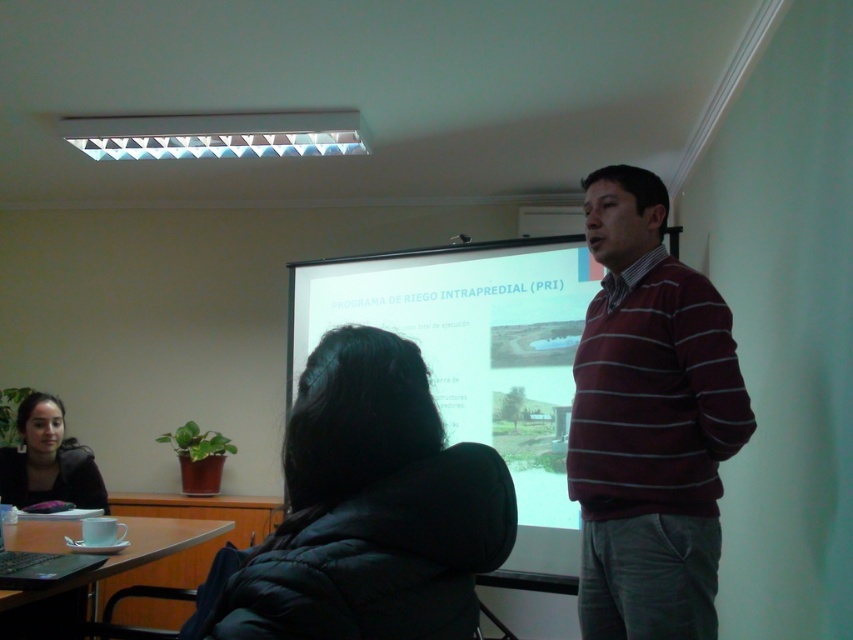
Between matte black jacket at lower left and matte black laptop at lower left, which one is positioned lower?

matte black jacket at lower left

Which is in front, point (27, 440) or point (13, 566)?

Point (13, 566)

You are a GUI agent. You are given a task and a screenshot of the screen. Output one action in this format:
    pyautogui.click(x=<x>, y=<y>)
    Task: Click on the matte black jacket at lower left
    Image resolution: width=853 pixels, height=640 pixels.
    Given the screenshot: What is the action you would take?
    pyautogui.click(x=48, y=460)

How far apart are maroon striped sweater at right and black puffer jacket at center?

maroon striped sweater at right is 3.46 feet away from black puffer jacket at center.

Who is taller, maroon striped sweater at right or black puffer jacket at center?

maroon striped sweater at right is taller.

In order to click on maroon striped sweater at right in this screenshot , I will do `click(648, 422)`.

This screenshot has width=853, height=640. What are the coordinates of `maroon striped sweater at right` in the screenshot? It's located at (648, 422).

Who is more forward, [289,356] or [84,458]?

Point [84,458]

Can you confirm if white matte projection screen at center is positioned above matte black jacket at lower left?

Yes, white matte projection screen at center is above matte black jacket at lower left.

Between point (392, 292) and point (68, 458), which one is positioned behind?

The point (392, 292) is more distant.

At what (x,y) coordinates should I click in order to perform the action: click on white matte projection screen at center. Please return your answer as a coordinate pair (x, y). Looking at the image, I should click on (473, 342).